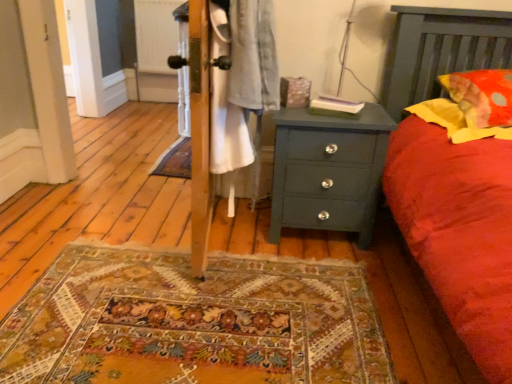
From the picture: What is the approximate width of teal painted wood chest of drawers at center?

It is 17.77 inches.

I want to click on white wood screen door at left, so click(48, 88).

This screenshot has width=512, height=384. Identify the location of teal painted wood chest of drawers at center. (328, 171).

From the image's perspective, is white wood screen door at left beneath soft yellow fabric pillow at right, the second pillow viewed from the top?

Incorrect, from the image's perspective, white wood screen door at left is higher than soft yellow fabric pillow at right, the second pillow viewed from the top.

Measure the distance from white wood screen door at left to soft yellow fabric pillow at right, the second pillow viewed from the top.

6.32 feet.

Is white wood screen door at left further to camera compared to soft yellow fabric pillow at right, the second pillow viewed from the top?

Yes, it is behind soft yellow fabric pillow at right, the second pillow viewed from the top.

From a real-world perspective, does white wood screen door at left stand above soft yellow fabric pillow at right, marked as the 1th pillow in a bottom-to-top arrangement?

No, from a real-world perspective, white wood screen door at left is not on top of soft yellow fabric pillow at right, marked as the 1th pillow in a bottom-to-top arrangement.

Does teal painted wood chest of drawers at center have a larger size compared to soft yellow fabric pillow at right, marked as the 1th pillow in a bottom-to-top arrangement?

Yes.

Is point (277, 243) closer or farther from the camera than point (461, 109)?

Point (277, 243) appears to be farther away from the viewer than point (461, 109).

Is teal painted wood chest of drawers at center oriented towards soft yellow fabric pillow at right, marked as the 1th pillow in a bottom-to-top arrangement?

No, teal painted wood chest of drawers at center is not oriented towards soft yellow fabric pillow at right, marked as the 1th pillow in a bottom-to-top arrangement.

From a real-world perspective, is teal painted wood chest of drawers at center physically below soft yellow fabric pillow at right, the second pillow viewed from the top?

Yes.

How distant is teal painted wood chest of drawers at center from white wood screen door at left?

They are 4.79 feet apart.

Considering the positions of point (368, 143) and point (46, 121), is point (368, 143) closer or farther from the camera than point (46, 121)?

Clearly, point (368, 143) is closer to the camera than point (46, 121).

Looking at this image, is teal painted wood chest of drawers at center inside the boundaries of white wood screen door at left, or outside?

teal painted wood chest of drawers at center is outside white wood screen door at left.

Locate an element on the screen. screen door on the left of teal painted wood chest of drawers at center is located at coordinates (48, 88).

Find the location of a particular element. The width and height of the screenshot is (512, 384). chest of drawers on the right of white wood screen door at left is located at coordinates (328, 171).

From the image's perspective, is white wood screen door at left on teal painted wood chest of drawers at center?

Correct, white wood screen door at left appears higher than teal painted wood chest of drawers at center in the image.

From a real-world perspective, is white wood screen door at left located beneath teal painted wood chest of drawers at center?

No, from a real-world perspective, white wood screen door at left is not below teal painted wood chest of drawers at center.

From a real-world perspective, is yellow fabric pillow at right, which appears as the second pillow when ordered from the bottom, below white wood screen door at left?

No, from a real-world perspective, yellow fabric pillow at right, which appears as the second pillow when ordered from the bottom, is not beneath white wood screen door at left.

Are yellow fabric pillow at right, which appears as the second pillow when ordered from the bottom, and white wood screen door at left far apart?

Yes.

Is yellow fabric pillow at right, arranged as the first pillow when viewed from the top, aimed at white wood screen door at left?

No, yellow fabric pillow at right, arranged as the first pillow when viewed from the top, is not oriented towards white wood screen door at left.

Which of these two, yellow fabric pillow at right, arranged as the first pillow when viewed from the top, or white wood screen door at left, is bigger?

white wood screen door at left is bigger.

Is yellow fabric pillow at right, which appears as the second pillow when ordered from the bottom, surrounded by soft yellow fabric pillow at right, marked as the 1th pillow in a bottom-to-top arrangement?

No, yellow fabric pillow at right, which appears as the second pillow when ordered from the bottom, is located outside of soft yellow fabric pillow at right, marked as the 1th pillow in a bottom-to-top arrangement.

From the image's perspective, does soft yellow fabric pillow at right, the second pillow viewed from the top, appear higher than yellow fabric pillow at right, arranged as the first pillow when viewed from the top?

No, from the image's perspective, soft yellow fabric pillow at right, the second pillow viewed from the top, is not above yellow fabric pillow at right, arranged as the first pillow when viewed from the top.

Consider the image. Considering the sizes of soft yellow fabric pillow at right, the second pillow viewed from the top, and yellow fabric pillow at right, arranged as the first pillow when viewed from the top, in the image, is soft yellow fabric pillow at right, the second pillow viewed from the top, bigger or smaller than yellow fabric pillow at right, arranged as the first pillow when viewed from the top,?

soft yellow fabric pillow at right, the second pillow viewed from the top, is smaller than yellow fabric pillow at right, arranged as the first pillow when viewed from the top.

In the scene shown: Between soft yellow fabric pillow at right, marked as the 1th pillow in a bottom-to-top arrangement, and yellow fabric pillow at right, arranged as the first pillow when viewed from the top, which one has smaller width?

yellow fabric pillow at right, arranged as the first pillow when viewed from the top, is thinner.

Is point (305, 146) behind point (510, 72)?

Yes, point (305, 146) is farther from viewer.

From the image's perspective, which is above, teal painted wood chest of drawers at center or yellow fabric pillow at right, arranged as the first pillow when viewed from the top?

yellow fabric pillow at right, arranged as the first pillow when viewed from the top, appears higher in the image.

Is teal painted wood chest of drawers at center not near yellow fabric pillow at right, arranged as the first pillow when viewed from the top?

No, teal painted wood chest of drawers at center is not far away from yellow fabric pillow at right, arranged as the first pillow when viewed from the top.

Is teal painted wood chest of drawers at center behind yellow fabric pillow at right, arranged as the first pillow when viewed from the top?

Yes, teal painted wood chest of drawers at center is further from the viewer.

I want to click on pillow that is the 1st one when counting rightward from the white wood screen door at left, so click(457, 120).

Starting from the teal painted wood chest of drawers at center, which pillow is the 2nd one in front? Please provide its 2D coordinates.

[(457, 120)]

Which object lies nearer to the anchor point white wood screen door at left, teal painted wood chest of drawers at center or yellow fabric pillow at right, which appears as the second pillow when ordered from the bottom?

teal painted wood chest of drawers at center is closer to white wood screen door at left.

Based on their spatial positions, is yellow fabric pillow at right, which appears as the second pillow when ordered from the bottom, or white wood screen door at left closer to soft yellow fabric pillow at right, the second pillow viewed from the top?

Among the two, yellow fabric pillow at right, which appears as the second pillow when ordered from the bottom, is located nearer to soft yellow fabric pillow at right, the second pillow viewed from the top.

From the image, which object appears to be nearer to teal painted wood chest of drawers at center, white wood screen door at left or yellow fabric pillow at right, arranged as the first pillow when viewed from the top?

yellow fabric pillow at right, arranged as the first pillow when viewed from the top.

Estimate the real-world distances between objects in this image. Which object is further from yellow fabric pillow at right, which appears as the second pillow when ordered from the bottom, soft yellow fabric pillow at right, marked as the 1th pillow in a bottom-to-top arrangement, or teal painted wood chest of drawers at center?

Among the two, teal painted wood chest of drawers at center is located further to yellow fabric pillow at right, which appears as the second pillow when ordered from the bottom.

Looking at the image, which one is located further to soft yellow fabric pillow at right, marked as the 1th pillow in a bottom-to-top arrangement, teal painted wood chest of drawers at center or yellow fabric pillow at right, which appears as the second pillow when ordered from the bottom?

The object further to soft yellow fabric pillow at right, marked as the 1th pillow in a bottom-to-top arrangement, is teal painted wood chest of drawers at center.

Based on their spatial positions, is soft yellow fabric pillow at right, the second pillow viewed from the top, or yellow fabric pillow at right, which appears as the second pillow when ordered from the bottom, further from white wood screen door at left?

Based on the image, yellow fabric pillow at right, which appears as the second pillow when ordered from the bottom, appears to be further to white wood screen door at left.

Considering their positions, is yellow fabric pillow at right, arranged as the first pillow when viewed from the top, positioned further to white wood screen door at left than soft yellow fabric pillow at right, the second pillow viewed from the top?

The object further to white wood screen door at left is yellow fabric pillow at right, arranged as the first pillow when viewed from the top.

Which object lies nearer to the anchor point yellow fabric pillow at right, which appears as the second pillow when ordered from the bottom, teal painted wood chest of drawers at center or white wood screen door at left?

The object closer to yellow fabric pillow at right, which appears as the second pillow when ordered from the bottom, is teal painted wood chest of drawers at center.

Find the location of a particular element. This screenshot has height=384, width=512. the chest of drawers located between white wood screen door at left and soft yellow fabric pillow at right, marked as the 1th pillow in a bottom-to-top arrangement, in the left-right direction is located at coordinates (328, 171).

You are a GUI agent. You are given a task and a screenshot of the screen. Output one action in this format:
    pyautogui.click(x=<x>, y=<y>)
    Task: Click on the pillow between teal painted wood chest of drawers at center and yellow fabric pillow at right, which appears as the second pillow when ordered from the bottom
    
    Given the screenshot: What is the action you would take?
    pyautogui.click(x=457, y=120)

The height and width of the screenshot is (384, 512). In order to click on pillow situated between white wood screen door at left and yellow fabric pillow at right, arranged as the first pillow when viewed from the top, from left to right in this screenshot , I will do `click(457, 120)`.

The width and height of the screenshot is (512, 384). Identify the location of the chest of drawers situated between white wood screen door at left and yellow fabric pillow at right, which appears as the second pillow when ordered from the bottom, from left to right. (328, 171).